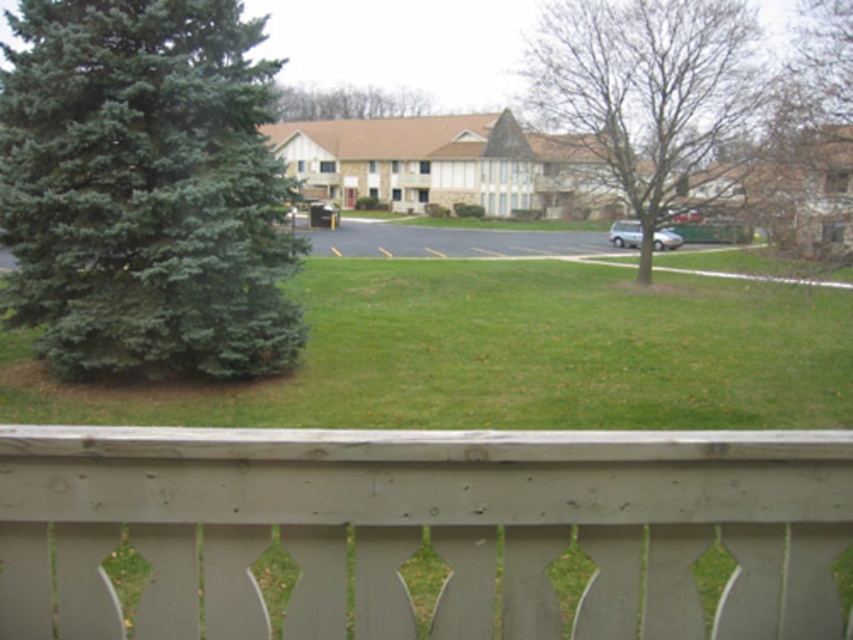
Question: Can you confirm if green matte evergreen tree at left is positioned above green leafy tree at upper center?

Choices:
 (A) no
 (B) yes

Answer: (A)

Question: Based on their relative distances, which object is nearer to the bare wood tree at center?

Choices:
 (A) gray wood fence at lower center
 (B) green matte evergreen tree at left
 (C) green leafy tree at upper center

Answer: (B)

Question: Where is green matte evergreen tree at left located in relation to green leafy tree at upper center in the image?

Choices:
 (A) below
 (B) above

Answer: (A)

Question: Is bare wood tree at center thinner than green leafy tree at upper center?

Choices:
 (A) no
 (B) yes

Answer: (B)

Question: Estimate the real-world distances between objects in this image. Which object is farther from the green matte evergreen tree at left?

Choices:
 (A) green leafy tree at upper center
 (B) bare wood tree at center
 (C) gray wood fence at lower center

Answer: (A)

Question: Which object appears farthest from the camera in this image?

Choices:
 (A) green matte evergreen tree at left
 (B) green leafy tree at upper center
 (C) bare wood tree at center

Answer: (B)